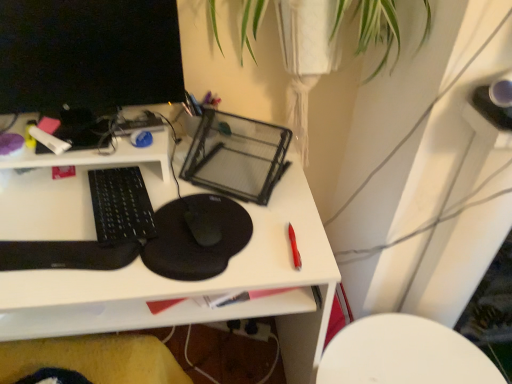
Question: Considering the relative sizes of red plastic pen at right, marked as the second stationery in a back-to-front arrangement, and black glossy computer monitor at upper left in the image provided, is red plastic pen at right, marked as the second stationery in a back-to-front arrangement, taller than black glossy computer monitor at upper left?

Choices:
 (A) yes
 (B) no

Answer: (B)

Question: Is red plastic pen at right, which is the first stationery from front to back, shorter than black glossy computer monitor at upper left?

Choices:
 (A) yes
 (B) no

Answer: (A)

Question: Is red plastic pen at right, which appears as the 1th stationery when ordered from the bottom, at the right side of black glossy computer monitor at upper left?

Choices:
 (A) yes
 (B) no

Answer: (A)

Question: Does red plastic pen at right, arranged as the second stationery when viewed from the top, contain black glossy computer monitor at upper left?

Choices:
 (A) no
 (B) yes

Answer: (A)

Question: Is the position of red plastic pen at right, arranged as the second stationery when viewed from the top, more distant than that of black glossy computer monitor at upper left?

Choices:
 (A) yes
 (B) no

Answer: (A)

Question: Considering the positions of white matte marker at upper left, the first stationery in the back-to-front sequence, and red plastic pen at right, marked as the second stationery in a back-to-front arrangement, in the image, is white matte marker at upper left, the first stationery in the back-to-front sequence, taller or shorter than red plastic pen at right, marked as the second stationery in a back-to-front arrangement,?

Choices:
 (A) short
 (B) tall

Answer: (B)

Question: Based on their sizes in the image, would you say white matte marker at upper left, the second stationery ordered from the bottom, is bigger or smaller than red plastic pen at right, the 2th stationery viewed from the left?

Choices:
 (A) small
 (B) big

Answer: (B)

Question: Would you say white matte marker at upper left, the second stationery from the front, is to the left or to the right of red plastic pen at right, arranged as the second stationery when viewed from the top, in the picture?

Choices:
 (A) left
 (B) right

Answer: (A)

Question: From a real-world perspective, is white matte marker at upper left, the second stationery from the front, positioned above or below red plastic pen at right, marked as the second stationery in a back-to-front arrangement?

Choices:
 (A) above
 (B) below

Answer: (A)

Question: From a real-world perspective, relative to black matte mousepad at center, is black matte mousepad at center vertically above or below?

Choices:
 (A) below
 (B) above

Answer: (B)

Question: Is point pyautogui.click(x=153, y=249) closer or farther from the camera than point pyautogui.click(x=282, y=274)?

Choices:
 (A) closer
 (B) farther

Answer: (B)

Question: Considering the positions of black matte mousepad at center and black matte mousepad at center in the image, is black matte mousepad at center wider or thinner than black matte mousepad at center?

Choices:
 (A) wide
 (B) thin

Answer: (B)

Question: In the image, is black matte mousepad at center positioned in front of or behind black matte mousepad at center?

Choices:
 (A) front
 (B) behind

Answer: (B)

Question: From a real-world perspective, relative to black matte mousepad at center, is black matte mouse at center vertically above or below?

Choices:
 (A) below
 (B) above

Answer: (B)

Question: Is point (189, 208) positioned closer to the camera than point (189, 203)?

Choices:
 (A) farther
 (B) closer

Answer: (B)